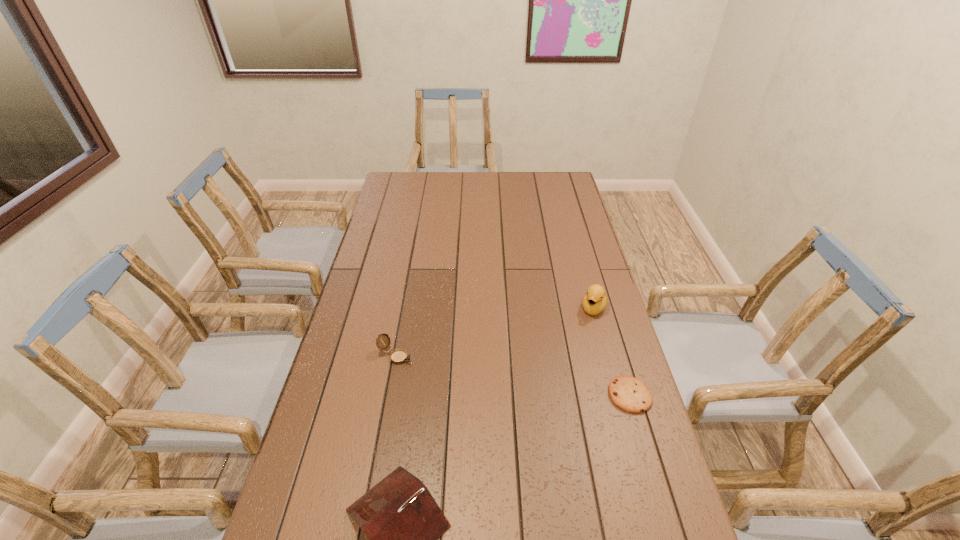
Find the location of a particular element. Image resolution: width=960 pixels, height=540 pixels. free space located on the face of the compass is located at coordinates (520, 418).

Image resolution: width=960 pixels, height=540 pixels. Find the location of `vacant area situated 0.220m on the face of the compass`. vacant area situated 0.220m on the face of the compass is located at coordinates (x=472, y=393).

Identify the location of object that is at the left edge. The image size is (960, 540). (398, 356).

The image size is (960, 540). Find the location of `cookie present at the right edge`. cookie present at the right edge is located at coordinates click(x=630, y=394).

Identify the location of duckling that is at the right edge. This screenshot has height=540, width=960. (595, 300).

In the image, there is a desktop. Where is `vacant space at the far edge`? This screenshot has height=540, width=960. vacant space at the far edge is located at coordinates (449, 177).

The width and height of the screenshot is (960, 540). What are the coordinates of `vacant position at the left edge of the desktop` in the screenshot? It's located at (366, 290).

This screenshot has width=960, height=540. Identify the location of blank space at the right edge. (576, 217).

In the image, there is a desktop. Where is `vacant area at the far left corner`? The width and height of the screenshot is (960, 540). vacant area at the far left corner is located at coordinates (392, 178).

In the image, there is a desktop. Identify the location of vacant space at the far right corner. (543, 183).